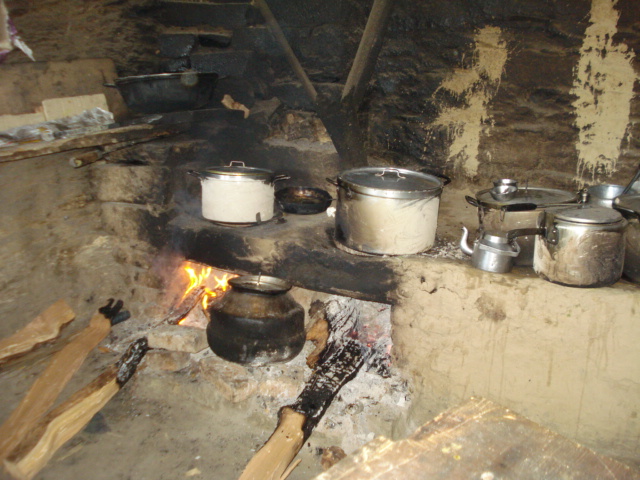
Identify the location of tea pot. (498, 252).